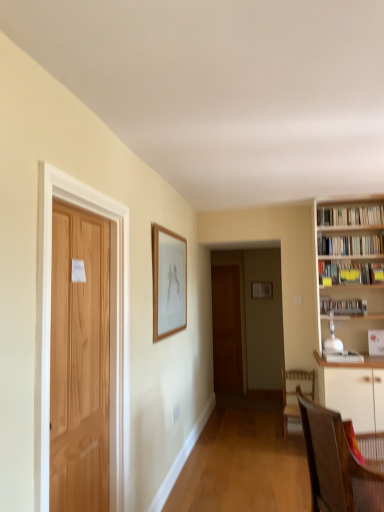
Question: Can you confirm if yellow paper at upper right, positioned as the third book in top-to-bottom order, is positioned to the right of brown woven chair at lower right, which is the 2th chair in back-to-front order?

Choices:
 (A) no
 (B) yes

Answer: (B)

Question: From the image's perspective, is yellow paper at upper right, the 2th book ordered from the bottom, on brown woven chair at lower right, the first chair viewed from the front?

Choices:
 (A) yes
 (B) no

Answer: (A)

Question: Is the position of yellow paper at upper right, positioned as the third book in top-to-bottom order, more distant than that of brown woven chair at lower right, the first chair viewed from the front?

Choices:
 (A) no
 (B) yes

Answer: (B)

Question: Is yellow paper at upper right, positioned as the third book in top-to-bottom order, closer to camera compared to brown woven chair at lower right, the first chair viewed from the front?

Choices:
 (A) yes
 (B) no

Answer: (B)

Question: Considering the relative sizes of yellow paper at upper right, the 2th book ordered from the bottom, and brown woven chair at lower right, the first chair viewed from the front, in the image provided, is yellow paper at upper right, the 2th book ordered from the bottom, bigger than brown woven chair at lower right, the first chair viewed from the front,?

Choices:
 (A) no
 (B) yes

Answer: (A)

Question: Do you think white glossy bookshelf at right, which ranks as the second book in top-to-bottom order, is within metallic silver bookshelf at right, which is counted as the 4th book, starting from the top, or outside of it?

Choices:
 (A) outside
 (B) inside

Answer: (A)

Question: Looking at their shapes, would you say white glossy bookshelf at right, which ranks as the second book in top-to-bottom order, is wider or thinner than metallic silver bookshelf at right, which is the 1th book from bottom to top?

Choices:
 (A) thin
 (B) wide

Answer: (B)

Question: Based on their sizes in the image, would you say white glossy bookshelf at right, which ranks as the second book in top-to-bottom order, is bigger or smaller than metallic silver bookshelf at right, which is the 1th book from bottom to top?

Choices:
 (A) small
 (B) big

Answer: (B)

Question: From the image's perspective, is white glossy bookshelf at right, placed as the 3th book when sorted from bottom to top, above or below metallic silver bookshelf at right, which is counted as the 4th book, starting from the top?

Choices:
 (A) below
 (B) above

Answer: (B)

Question: Is wooden picture frame at center, positioned as the 2th picture frame in left-to-right order, inside or outside of natural wood door at left, which is counted as the second door, starting from the back?

Choices:
 (A) outside
 (B) inside

Answer: (A)

Question: In terms of size, does wooden picture frame at center, the first picture frame positioned from the back, appear bigger or smaller than natural wood door at left, which is counted as the second door, starting from the back?

Choices:
 (A) big
 (B) small

Answer: (B)

Question: From their relative heights in the image, would you say wooden picture frame at center, positioned as the 2th picture frame in left-to-right order, is taller or shorter than natural wood door at left, which ranks as the first door in front-to-back order?

Choices:
 (A) tall
 (B) short

Answer: (B)

Question: Based on their positions, is wooden picture frame at center, which is the first picture frame in right-to-left order, located to the left or right of natural wood door at left, which is counted as the second door, starting from the back?

Choices:
 (A) left
 (B) right

Answer: (B)

Question: Considering the positions of white glossy bookshelf at right, which ranks as the second book in top-to-bottom order, and white paper bookshelf at upper right, which is the first book in top-to-bottom order, in the image, is white glossy bookshelf at right, which ranks as the second book in top-to-bottom order, wider or thinner than white paper bookshelf at upper right, which is the first book in top-to-bottom order,?

Choices:
 (A) wide
 (B) thin

Answer: (A)

Question: Is point (354, 249) positioned closer to the camera than point (367, 211)?

Choices:
 (A) closer
 (B) farther

Answer: (B)